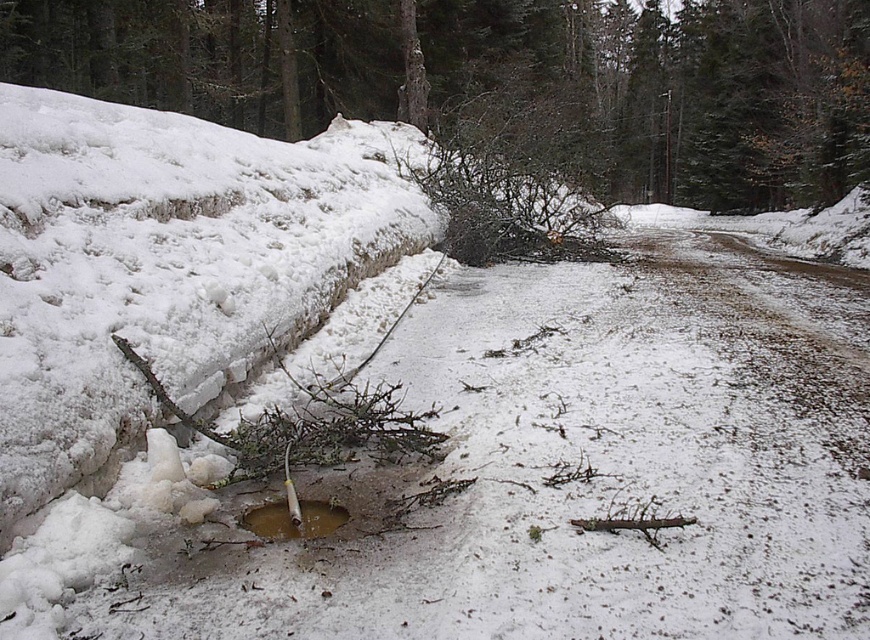
Question: Which point appears farthest from the camera in this image?

Choices:
 (A) (105, 97)
 (B) (266, 502)

Answer: (A)

Question: Considering the relative positions of smooth snow-covered tree trunk at center and brown matte puddle at center in the image provided, where is smooth snow-covered tree trunk at center located with respect to brown matte puddle at center?

Choices:
 (A) below
 (B) above

Answer: (B)

Question: In this image, where is smooth snow-covered tree trunk at center located relative to brown matte puddle at center?

Choices:
 (A) left
 (B) right

Answer: (B)

Question: Which point is closer to the camera?

Choices:
 (A) (263, 532)
 (B) (573, 92)

Answer: (A)

Question: Which object appears closest to the camera in this image?

Choices:
 (A) smooth snow-covered tree trunk at center
 (B) brown matte puddle at center

Answer: (B)

Question: Does smooth snow-covered tree trunk at center appear over brown matte puddle at center?

Choices:
 (A) no
 (B) yes

Answer: (B)